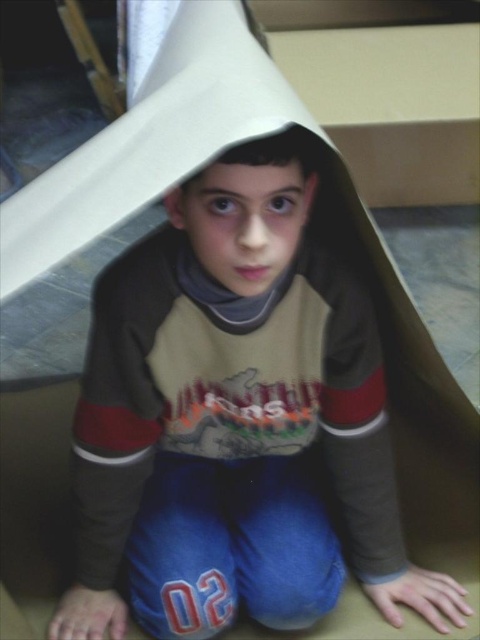
Question: Among these points, which one is farthest from the camera?

Choices:
 (A) (224, 285)
 (B) (354, 392)

Answer: (B)

Question: Does matte brown hoodie at center appear on the right side of matte brown paper bag at center?

Choices:
 (A) yes
 (B) no

Answer: (A)

Question: Which object appears closest to the camera in this image?

Choices:
 (A) matte brown paper bag at center
 (B) matte brown hoodie at center

Answer: (A)

Question: Is matte brown hoodie at center closer to the viewer compared to matte brown paper bag at center?

Choices:
 (A) yes
 (B) no

Answer: (B)

Question: Can you confirm if matte brown hoodie at center is bigger than matte brown paper bag at center?

Choices:
 (A) no
 (B) yes

Answer: (B)